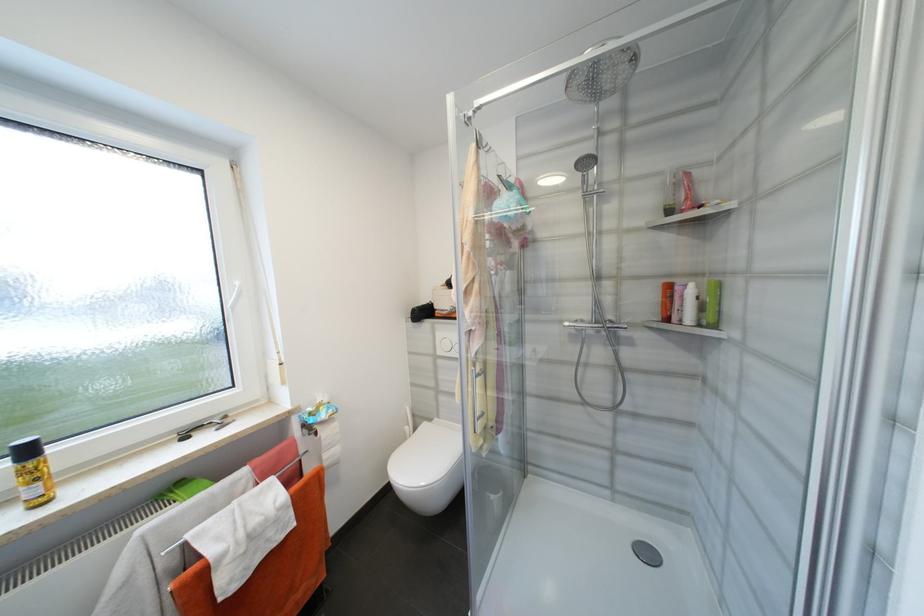
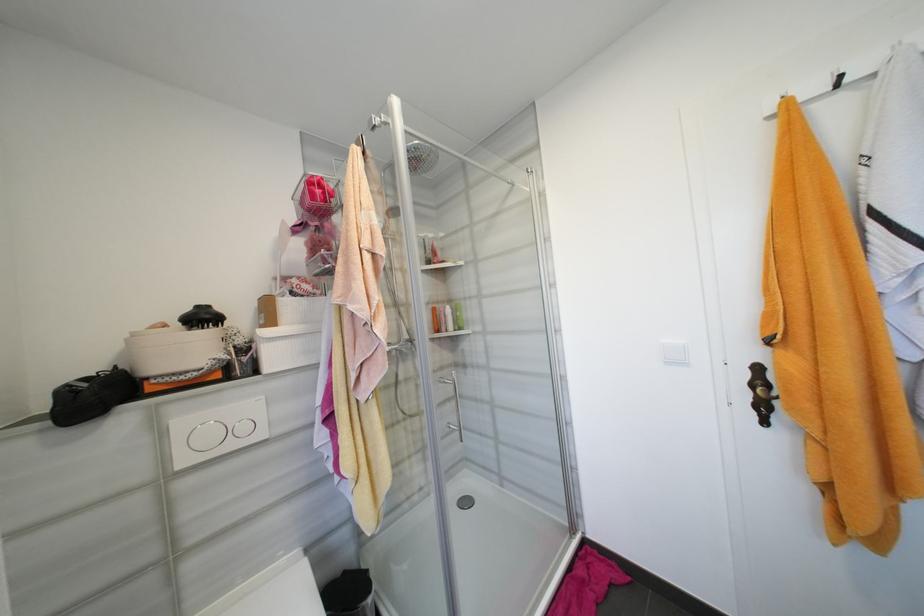
Locate, in the second image, the point that corresponds to (445,353) in the first image.

(189, 463)